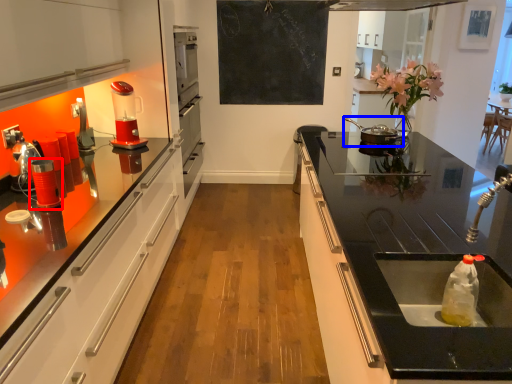
Question: Which point is closer to the camera, appliance (highlighted by a red box) or appliance (highlighted by a blue box)?

Choices:
 (A) appliance
 (B) appliance

Answer: (A)